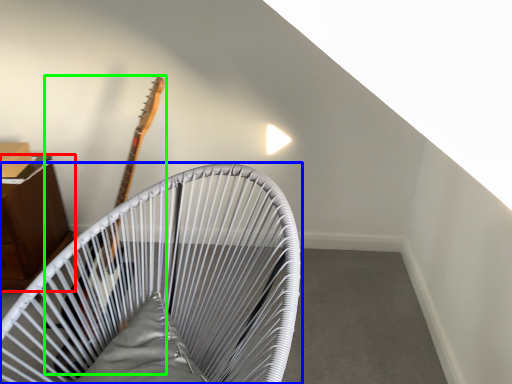
Question: Which is nearer to the furniture (highlighted by a red box)? furniture (highlighted by a blue box) or guitar (highlighted by a green box).

Choices:
 (A) furniture
 (B) guitar

Answer: (B)